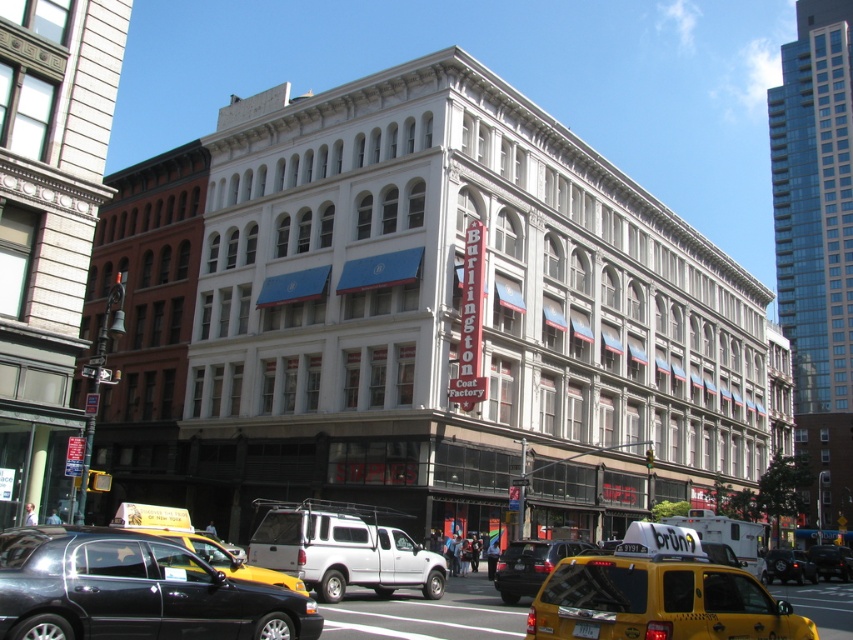
Question: Which object is the farthest from the yellow rubber taxi cab at lower left?

Choices:
 (A) black glossy sedan at lower left
 (B) yellow rubber car at lower right
 (C) metallic silver suv at center
 (D) white matte truck at center

Answer: (B)

Question: From the image, what is the correct spatial relationship of yellow rubber taxi at lower right in relation to yellow rubber car at lower right?

Choices:
 (A) right
 (B) left

Answer: (B)

Question: Is yellow rubber taxi at lower right further to camera compared to white matte truck at center?

Choices:
 (A) yes
 (B) no

Answer: (B)

Question: Which point appears closest to the camera in this image?

Choices:
 (A) (122, 504)
 (B) (335, 577)
 (C) (263, 636)

Answer: (C)

Question: Does white matte truck at center have a greater width compared to metallic silver suv at center?

Choices:
 (A) no
 (B) yes

Answer: (B)

Question: Which point is farther to the camera?

Choices:
 (A) (677, 618)
 (B) (318, 506)
 (C) (172, 634)

Answer: (B)